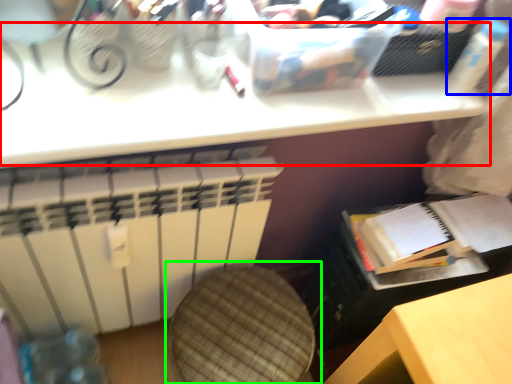
Question: Which object is positioned farthest from table (highlighted by a red box)? Select from bottle (highlighted by a blue box) and swivel chair (highlighted by a green box).

Choices:
 (A) bottle
 (B) swivel chair

Answer: (B)